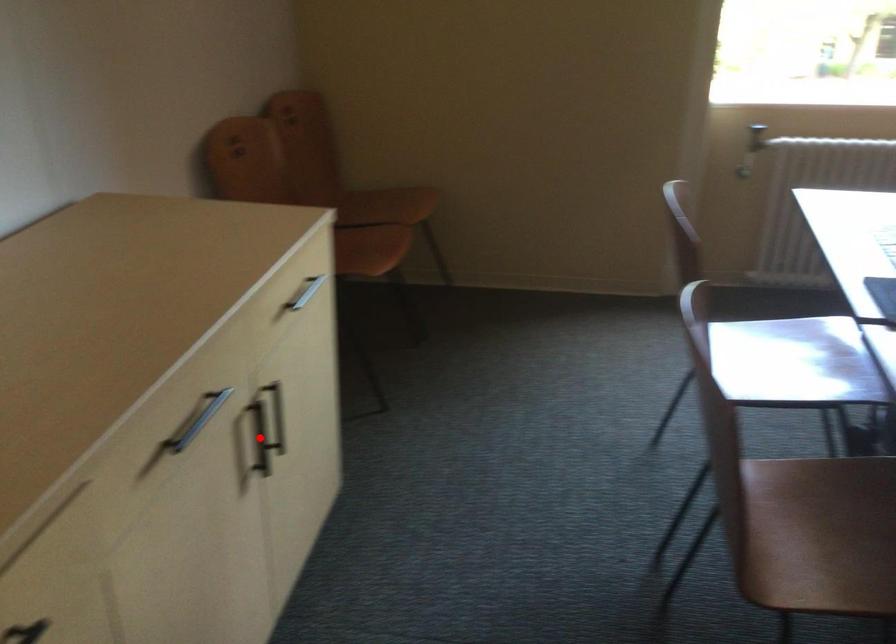
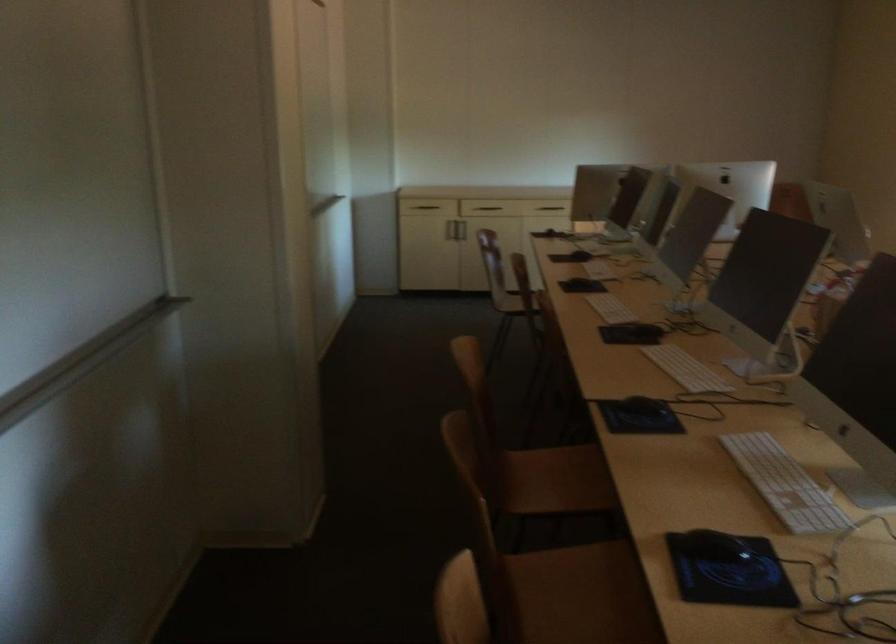
Question: I am providing you with two images of the same scene from different viewpoints. A red point is marked on the first image. Can you still see the location of the red point in image 2?

Choices:
 (A) Yes
 (B) No

Answer: (B)